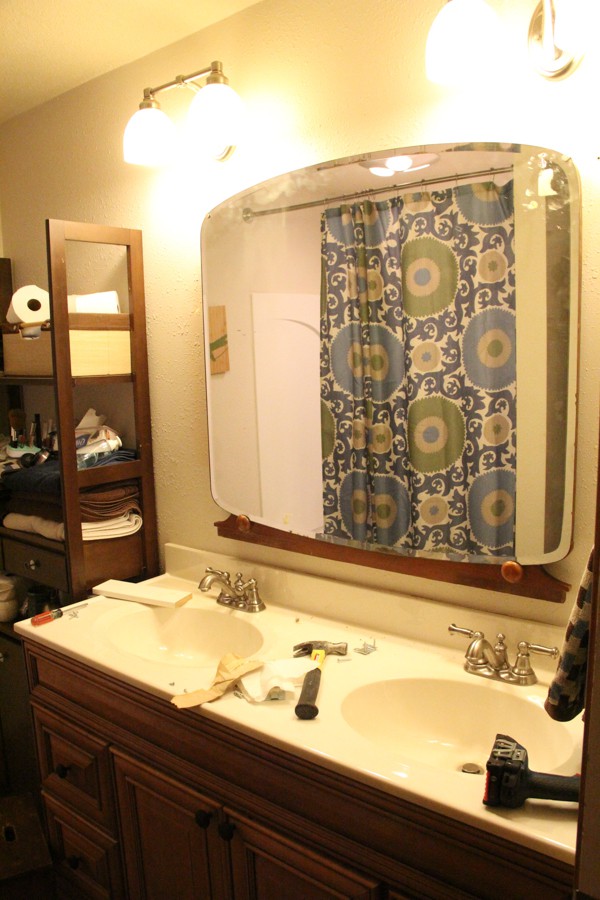
Locate an element on the screen. The width and height of the screenshot is (600, 900). cabinet is located at coordinates (177, 850), (257, 873).